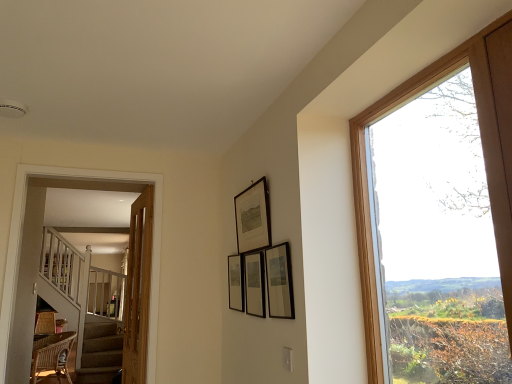
Question: Would you say matte black picture frame at center, which appears as the 2th picture frame when viewed from the back, is inside or outside clear glass window at right?

Choices:
 (A) outside
 (B) inside

Answer: (A)

Question: From the image's perspective, is matte black picture frame at center, the 3th picture frame viewed from the front, above or below clear glass window at right?

Choices:
 (A) below
 (B) above

Answer: (A)

Question: Which object is the closest to the wooden framed print at upper center, which appears as the 2th picture frame when viewed from the front?

Choices:
 (A) white wooden staircase at left
 (B) matte black picture frame at center, which appears as the 2th picture frame when viewed from the back
 (C) matte black picture frame at center, marked as the first picture frame in a back-to-front arrangement
 (D) matte black picture frame at upper center, arranged as the 1th picture frame when viewed from the front
 (E) clear glass window at right

Answer: (B)

Question: Considering the real-world distances, which object is closest to the white wooden staircase at left?

Choices:
 (A) matte black picture frame at upper center, arranged as the 4th picture frame when viewed from the back
 (B) clear glass window at right
 (C) matte black picture frame at center, marked as the first picture frame in a back-to-front arrangement
 (D) wooden framed print at upper center, arranged as the third picture frame when viewed from the back
 (E) matte black picture frame at center, the 3th picture frame viewed from the front

Answer: (C)